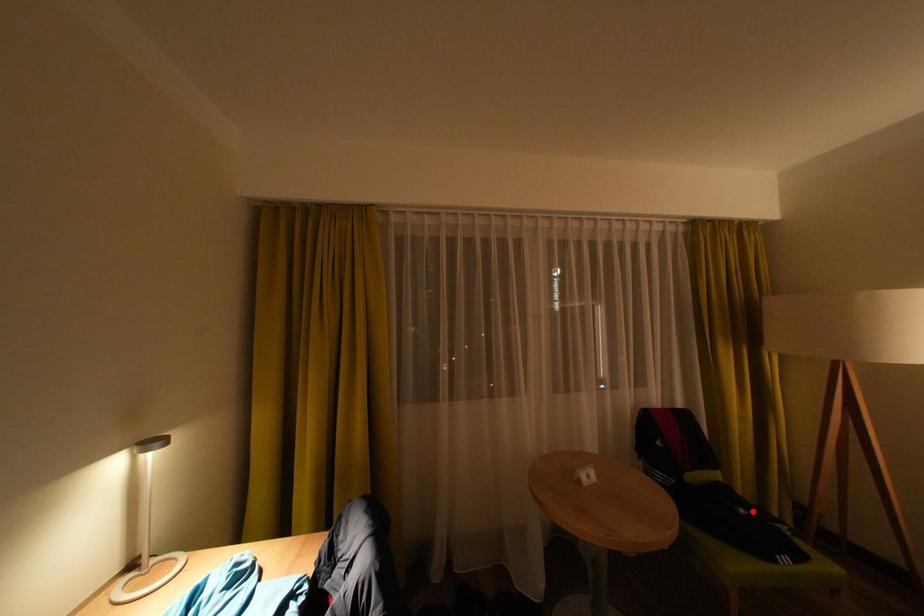
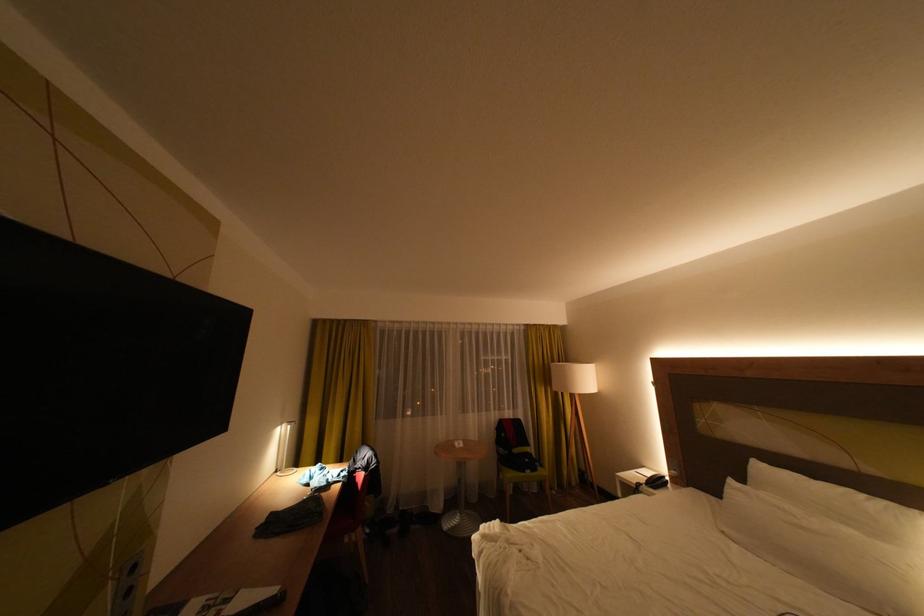
Question: I am providing you with two images of the same scene from different viewpoints. In image1, a red point is highlighted. Considering the same 3D point in image2, which of the following is correct?

Choices:
 (A) It is closer
 (B) It is farther

Answer: (B)